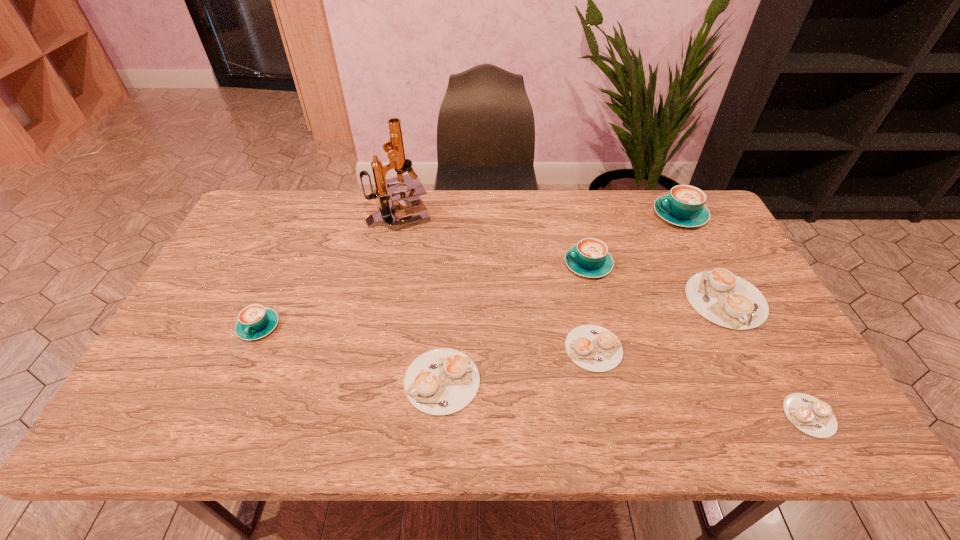
At what (x,y) coordinates should I click in order to perform the action: click on object that is at the left edge. Please return your answer as a coordinate pair (x, y). This screenshot has width=960, height=540. Looking at the image, I should click on (255, 321).

This screenshot has width=960, height=540. What are the coordinates of `object located at the far right corner` in the screenshot? It's located at (684, 206).

What are the coordinates of `object at the near right corner` in the screenshot? It's located at (810, 415).

In the image, there is a desktop. At what (x,y) coordinates should I click in order to perform the action: click on vacant space at the far edge. Please return your answer as a coordinate pair (x, y). The image size is (960, 540). Looking at the image, I should click on (319, 191).

The height and width of the screenshot is (540, 960). I want to click on vacant space at the near edge of the desktop, so click(x=459, y=423).

This screenshot has height=540, width=960. In the image, there is a desktop. Identify the location of vacant space at the left edge. (214, 320).

At what (x,y) coordinates should I click in order to perform the action: click on vacant space at the right edge of the desktop. Please return your answer as a coordinate pair (x, y). The width and height of the screenshot is (960, 540). Looking at the image, I should click on (765, 374).

This screenshot has height=540, width=960. I want to click on empty space that is in between the second smallest turquoise cappuccino and the third white cappuccino from right to left, so click(x=590, y=307).

Locate an element on the screen. This screenshot has height=540, width=960. empty location between the third tallest cappuccino and the second farthest turquoise cappuccino is located at coordinates (423, 296).

Locate an element on the screen. The height and width of the screenshot is (540, 960). free space between the shortest object and the third shortest cappuccino is located at coordinates (626, 399).